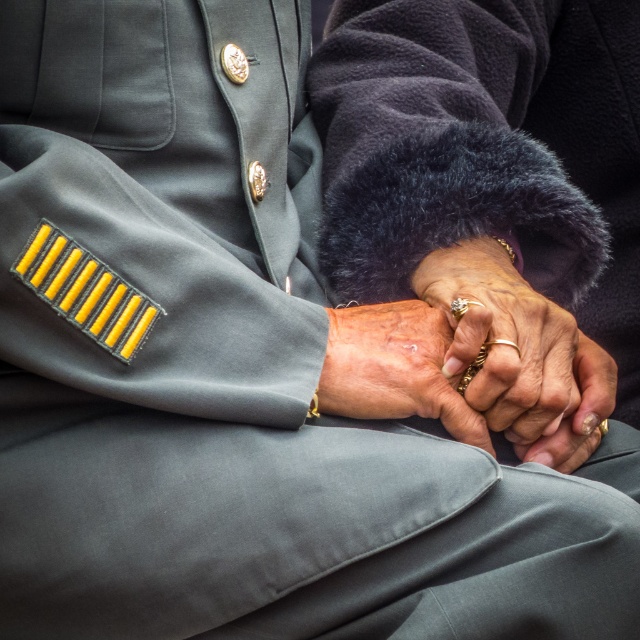
You are a dermatologist examining the image of two hands holding each other. You notice the gold textured ring at center and the dry skin at center. Which object is higher up in the image?

The gold textured ring at center is taller than dry skin at center, so the gold textured ring at center is higher up in the image.

You are a photographer standing at a certain distance from the gold textured ring at center. If your camera has a focal length of 50mm and you want to capture the ring in focus without moving closer, what is the minimum distance you should maintain to ensure sharpness?

The gold textured ring at center is 36.87 inches away from the viewer. To capture it in focus with a 50mm lens, you should maintain at least 36.87 inches distance to ensure sharpness without moving closer.